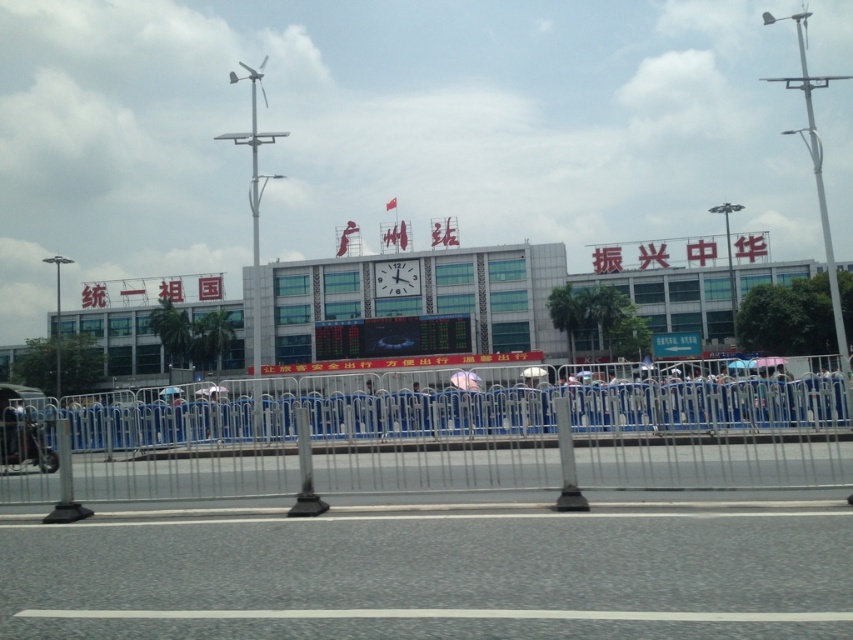
You are a photographer planning to capture the Guangzhou Railway Station building. You notice a white metallic pole at upper right and a white glossy clock at center in your frame. Which object appears wider in the photo?

The white metallic pole at upper right appears wider than the white glossy clock at center because its width surpasses the clock.

You are a visitor at the Guangzhou Railway Station and want to take a photo of the clock on the building while standing behind the metallic blue fence at center. However, there is a pink fabric umbrella at center in the way. Can you see the clock through the space between them?

The metallic blue fence at center is much taller than the pink fabric umbrella at center, so yes, you can see the clock through the space between them because the metallic blue fence at center blocks the view above the umbrella.

You are a visitor at the Guangzhou Railway Station. You see the white metallic pole at upper right and the white glossy clock at center. Which object is positioned higher in the image?

The white metallic pole at upper right is positioned higher than the white glossy clock at center.